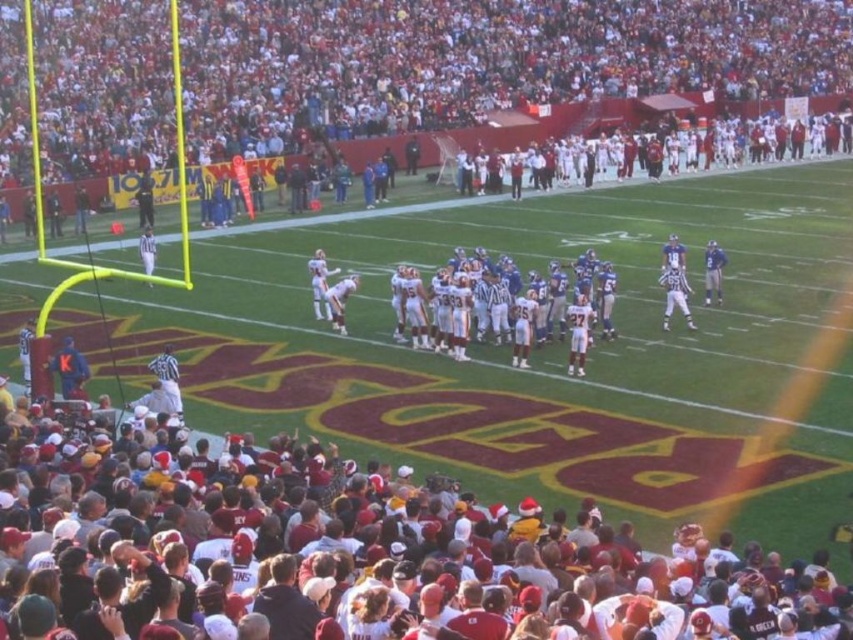
Question: Does maroon fabric crowd at lower center have a lesser width compared to red fabric crowd at upper center?

Choices:
 (A) yes
 (B) no

Answer: (A)

Question: Where is maroon fabric crowd at lower center located in relation to red fabric crowd at upper center in the image?

Choices:
 (A) above
 (B) below

Answer: (B)

Question: Which point is closer to the camera taking this photo?

Choices:
 (A) (560, 570)
 (B) (119, 124)

Answer: (A)

Question: Which object appears farthest from the camera in this image?

Choices:
 (A) maroon fabric crowd at lower center
 (B) red fabric crowd at upper center

Answer: (B)

Question: Can you confirm if maroon fabric crowd at lower center is smaller than red fabric crowd at upper center?

Choices:
 (A) yes
 (B) no

Answer: (A)

Question: Which of the following is the closest to the observer?

Choices:
 (A) maroon fabric crowd at lower center
 (B) red fabric crowd at upper center

Answer: (A)